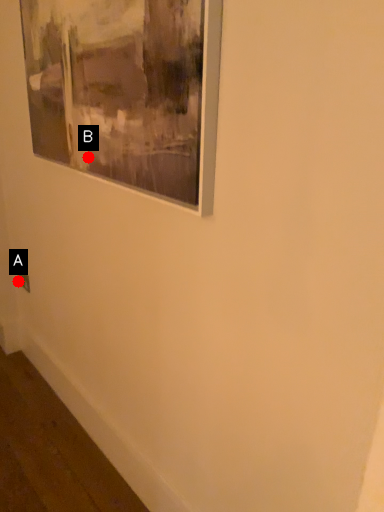
Question: Two points are circled on the image, labeled by A and B beside each circle. Which point is farther to the camera?

Choices:
 (A) A is further
 (B) B is further

Answer: (A)